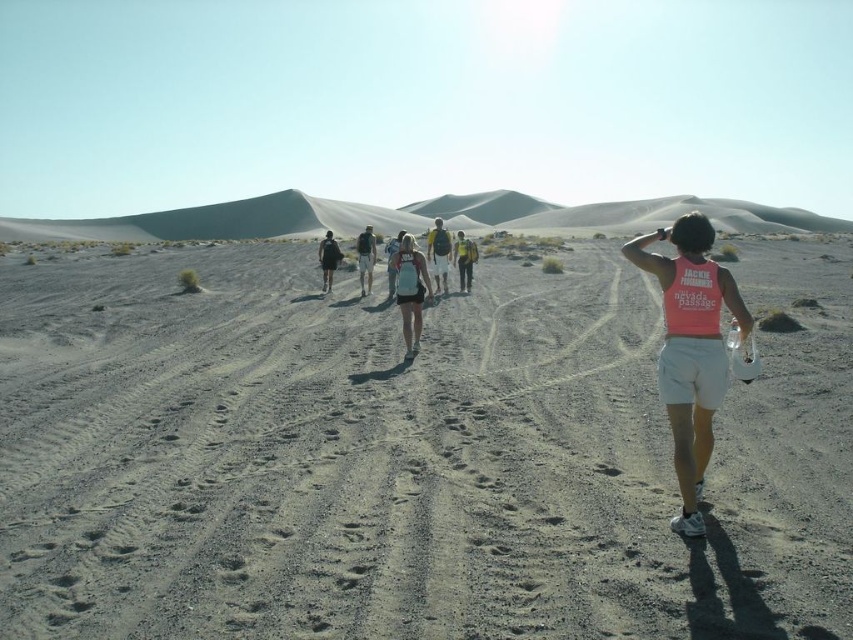
Is the position of yellow fabric backpack at center more distant than that of pink fabric tank top at center?

That is True.

Between yellow fabric backpack at center and pink fabric tank top at center, which one is positioned lower?

Positioned lower is pink fabric tank top at center.

Where is `yellow fabric backpack at center`? yellow fabric backpack at center is located at coordinates (463, 259).

This screenshot has width=853, height=640. What do you see at coordinates (405, 458) in the screenshot?
I see `gray sandy dirt track at center` at bounding box center [405, 458].

Who is more forward, (271, 328) or (328, 250)?

Point (271, 328) is more forward.

Where is `gray sandy dirt track at center`? gray sandy dirt track at center is located at coordinates (405, 458).

Can you confirm if gray sandy dirt track at center is taller than matte black backpack at center?

Incorrect, gray sandy dirt track at center's height is not larger of matte black backpack at center's.

Is point (201, 250) positioned behind point (363, 237)?

That is True.

Identify the location of gray sandy dirt track at center. This screenshot has width=853, height=640. (405, 458).